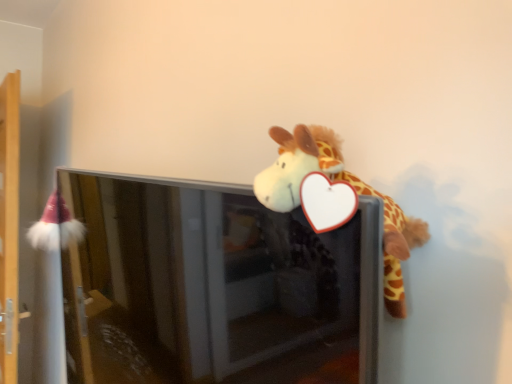
Question: Can you confirm if wooden shelf at left is smaller than transparent glass screen door at upper center?

Choices:
 (A) yes
 (B) no

Answer: (A)

Question: Is wooden shelf at left facing towards transparent glass screen door at upper center?

Choices:
 (A) yes
 (B) no

Answer: (B)

Question: Does wooden shelf at left have a greater height compared to transparent glass screen door at upper center?

Choices:
 (A) no
 (B) yes

Answer: (B)

Question: Is wooden shelf at left shorter than transparent glass screen door at upper center?

Choices:
 (A) no
 (B) yes

Answer: (A)

Question: Are wooden shelf at left and transparent glass screen door at upper center located far from each other?

Choices:
 (A) yes
 (B) no

Answer: (A)

Question: From the image's perspective, does wooden shelf at left appear lower than transparent glass screen door at upper center?

Choices:
 (A) yes
 (B) no

Answer: (B)

Question: Is transparent glass screen door at upper center further to camera compared to wooden shelf at left?

Choices:
 (A) no
 (B) yes

Answer: (A)

Question: Does transparent glass screen door at upper center have a greater width compared to wooden shelf at left?

Choices:
 (A) no
 (B) yes

Answer: (B)

Question: Considering the relative positions of transparent glass screen door at upper center and wooden shelf at left in the image provided, is transparent glass screen door at upper center to the right of wooden shelf at left from the viewer's perspective?

Choices:
 (A) yes
 (B) no

Answer: (A)

Question: Does transparent glass screen door at upper center have a smaller size compared to wooden shelf at left?

Choices:
 (A) yes
 (B) no

Answer: (B)

Question: From a real-world perspective, is transparent glass screen door at upper center beneath wooden shelf at left?

Choices:
 (A) yes
 (B) no

Answer: (A)

Question: Does transparent glass screen door at upper center have a larger size compared to wooden shelf at left?

Choices:
 (A) no
 (B) yes

Answer: (B)

Question: From their relative heights in the image, would you say transparent glass screen door at upper center is taller or shorter than wooden shelf at left?

Choices:
 (A) short
 (B) tall

Answer: (A)